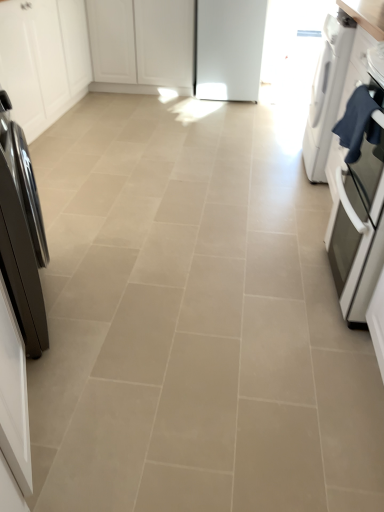
The width and height of the screenshot is (384, 512). I want to click on vacant space in front of white glossy dryer at right, the 1th home appliance from the back, so click(297, 196).